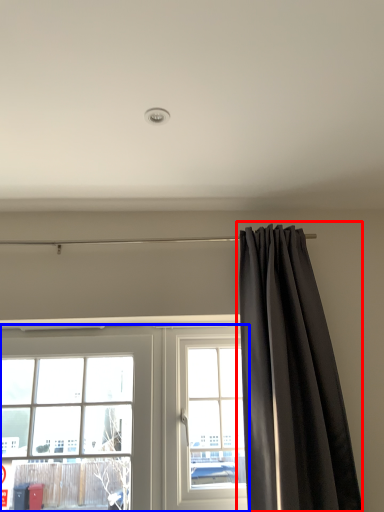
Question: Among these objects, which one is nearest to the camera, curtain (highlighted by a red box) or window (highlighted by a blue box)?

Choices:
 (A) curtain
 (B) window

Answer: (A)